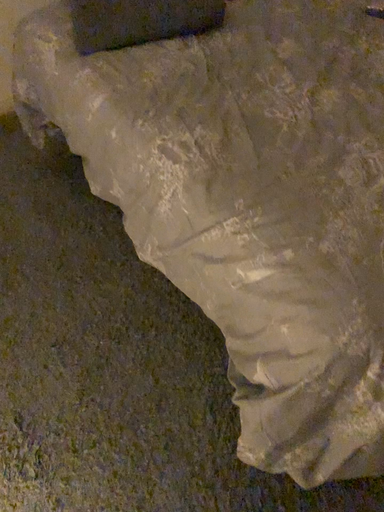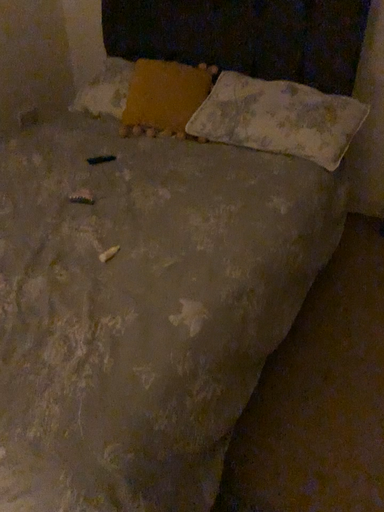
Question: Which way did the camera rotate in the video?

Choices:
 (A) rotated upward
 (B) rotated downward

Answer: (A)